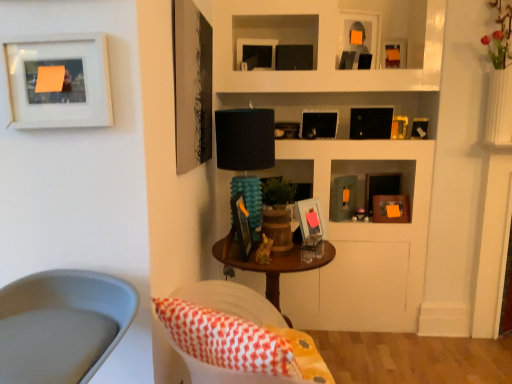
Question: Which direction should I rotate to face matte black picture frame at center, which ranks as the eleventh picture frame in front-to-back order, — up or down?

Choices:
 (A) down
 (B) up

Answer: (B)

Question: Does matte black picture frame at center, which ranks as the eleventh picture frame in front-to-back order, have a greater height compared to smooth gray swivel chair at lower left?

Choices:
 (A) no
 (B) yes

Answer: (A)

Question: Is matte black picture frame at center, the 1th picture frame from the back, not within smooth gray swivel chair at lower left?

Choices:
 (A) no
 (B) yes

Answer: (B)

Question: Does matte black picture frame at center, the 1th picture frame from the back, have a larger size compared to smooth gray swivel chair at lower left?

Choices:
 (A) no
 (B) yes

Answer: (A)

Question: Is smooth gray swivel chair at lower left located within matte black picture frame at center, the 1th picture frame from the back?

Choices:
 (A) no
 (B) yes

Answer: (A)

Question: Is matte black picture frame at center, which ranks as the eleventh picture frame in front-to-back order, closer to the viewer compared to smooth gray swivel chair at lower left?

Choices:
 (A) no
 (B) yes

Answer: (A)

Question: Is matte black picture frame at center, which ranks as the eleventh picture frame in front-to-back order, further to the viewer compared to smooth gray swivel chair at lower left?

Choices:
 (A) no
 (B) yes

Answer: (B)

Question: Considering the relative sizes of matte black picture frame at upper center, the second picture frame from the back, and black matte picture frame at upper center, arranged as the 7th picture frame when viewed from the front, in the image provided, is matte black picture frame at upper center, the second picture frame from the back, thinner than black matte picture frame at upper center, arranged as the 7th picture frame when viewed from the front,?

Choices:
 (A) no
 (B) yes

Answer: (B)

Question: Is matte black picture frame at upper center, the tenth picture frame when ordered from front to back, looking in the opposite direction of black matte picture frame at upper center, arranged as the 7th picture frame when viewed from the front?

Choices:
 (A) no
 (B) yes

Answer: (A)

Question: From a real-world perspective, is matte black picture frame at upper center, the tenth picture frame when ordered from front to back, under black matte picture frame at upper center, arranged as the 7th picture frame when viewed from the front?

Choices:
 (A) no
 (B) yes

Answer: (A)

Question: From the image's perspective, would you say matte black picture frame at upper center, the second picture frame from the back, is shown under black matte picture frame at upper center, arranged as the 7th picture frame when viewed from the front?

Choices:
 (A) yes
 (B) no

Answer: (B)

Question: Does matte black picture frame at upper center, the second picture frame from the back, have a greater width compared to black matte picture frame at upper center, arranged as the 7th picture frame when viewed from the front?

Choices:
 (A) no
 (B) yes

Answer: (A)

Question: Is matte black picture frame at upper center, the second picture frame from the back, closer to camera compared to black matte picture frame at upper center, placed as the 5th picture frame when sorted from back to front?

Choices:
 (A) yes
 (B) no

Answer: (B)

Question: Does matte white picture frame at upper left, acting as the 11th picture frame starting from the back, have a lesser height compared to smooth gray swivel chair at lower left?

Choices:
 (A) no
 (B) yes

Answer: (B)